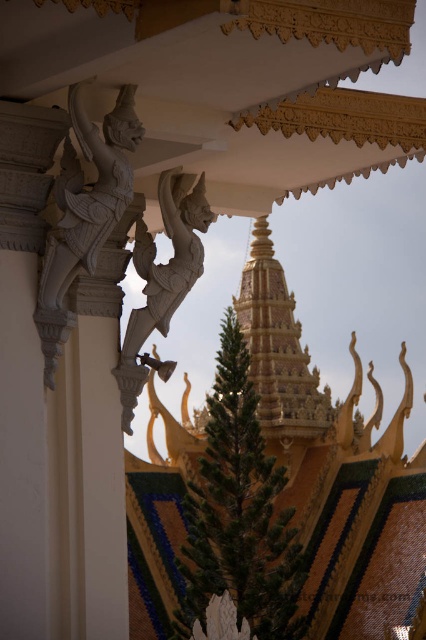
In the scene shown: You are an architect inspecting the temple structure. You need to determine if the white stone statue at upper left can be placed on a platform designed for the gold textured spire at center. Based on their sizes, will it fit?

The white stone statue at upper left has a smaller size compared to gold textured spire at center, so it can fit on the platform designed for the gold textured spire at center.

You are an architect visiting this site and want to take a photo of both the gold textured spire at center and the white stone statue at center. Which object should you focus on first if you want to include both in your frame without zooming in or out?

The gold textured spire at center is larger in size than the white stone statue at center, so you should focus on the gold textured spire at center first to ensure it fits properly in the frame before adjusting for the smaller statue.

You are an architect examining the temple structure. You notice a white stone statue at upper left marked by point (83, 212). Is this statue positioned closer to the golden spire or the carved stone figures in the foreground?

The point (83, 212) marks the white stone statue at upper left, which is closer to the golden spire than the carved stone figures in the foreground.